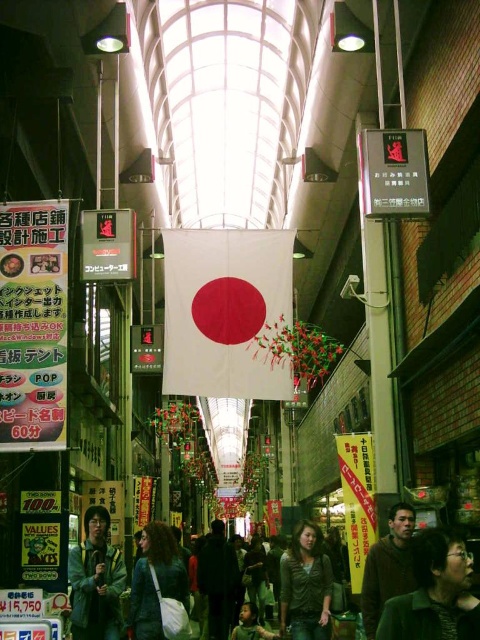
Is dark brown sweater at lower right bigger than green denim jacket at lower left?

No.

Who is more forward, (384, 604) or (104, 608)?

Positioned in front is point (384, 604).

Where is `dark brown sweater at lower right`? The width and height of the screenshot is (480, 640). dark brown sweater at lower right is located at coordinates (434, 593).

Which is above, brown fuzzy sweater at center or green fabric shirt at center?

brown fuzzy sweater at center is above.

Does brown fuzzy sweater at center appear over green fabric shirt at center?

Yes, brown fuzzy sweater at center is above green fabric shirt at center.

Which is behind, point (371, 618) or point (245, 621)?

The point (245, 621) is behind.

At what (x,y) coordinates should I click in order to perform the action: click on brown fuzzy sweater at center. Please return your answer as a coordinate pair (x, y). Looking at the image, I should click on (387, 566).

Is the position of brown fuzzy sweater at center more distant than that of dark gray fabric coat at center?

No, it is in front of dark gray fabric coat at center.

Describe the element at coordinates (387, 566) in the screenshot. This screenshot has width=480, height=640. I see `brown fuzzy sweater at center` at that location.

Between point (396, 513) and point (205, 584), which one is positioned in front?

Positioned in front is point (396, 513).

Identify the location of brown fuzzy sweater at center. [387, 566].